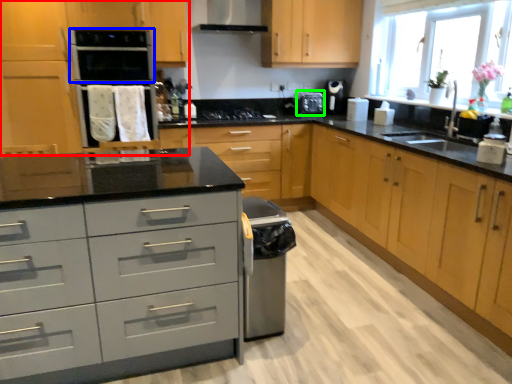
Question: Which object is positioned closest to cabinetry (highlighted by a red box)? Select from oven (highlighted by a blue box) and appliance (highlighted by a green box).

Choices:
 (A) oven
 (B) appliance

Answer: (A)